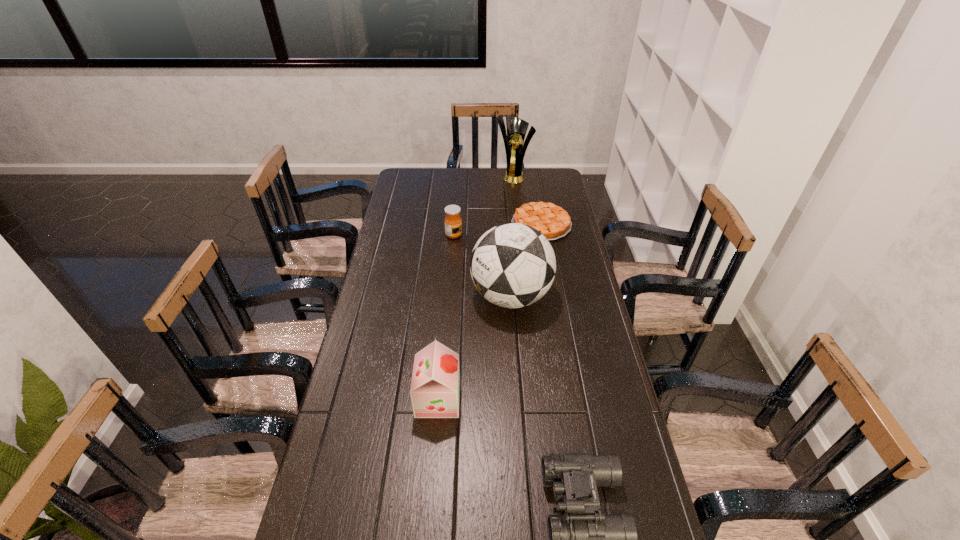
Find the location of `award`. award is located at coordinates [513, 140].

This screenshot has height=540, width=960. Identify the location of soccer ball. (512, 265).

I want to click on the third tallest object, so click(435, 386).

This screenshot has width=960, height=540. What are the coordinates of `the fifth farthest object` in the screenshot? It's located at (435, 386).

I want to click on honey, so click(x=453, y=222).

This screenshot has width=960, height=540. What are the coordinates of `pie` in the screenshot? It's located at tap(553, 222).

At what (x,y) coordinates should I click in order to perform the action: click on free space located at the front of the award, where the globe is visible. Please return your answer as a coordinate pair (x, y). This screenshot has height=540, width=960. Looking at the image, I should click on (518, 216).

At what (x,y) coordinates should I click in order to perform the action: click on free space located on the surface of the fourth farthest object where the brand logo is visible. Please return your answer as a coordinate pair (x, y). Looking at the image, I should click on (448, 296).

Where is `vacant space located on the surface of the fourth farthest object where the brand logo is visible`? The width and height of the screenshot is (960, 540). vacant space located on the surface of the fourth farthest object where the brand logo is visible is located at coordinates (438, 296).

Where is `free space located on the surface of the fourth farthest object where the brand logo is visible`? free space located on the surface of the fourth farthest object where the brand logo is visible is located at coordinates (367, 296).